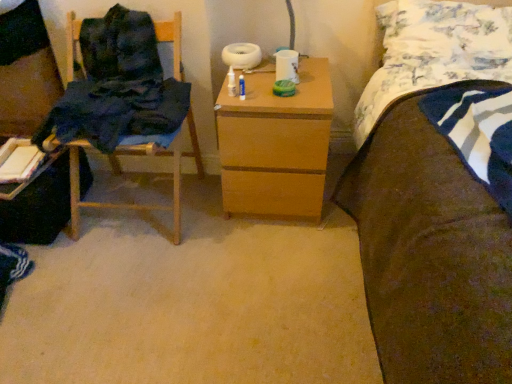
At what (x,y) coordinates should I click in order to perform the action: click on free space in front of wooden chair at left. Please return your answer as a coordinate pair (x, y). Image resolution: width=512 pixels, height=384 pixels. Looking at the image, I should click on (118, 280).